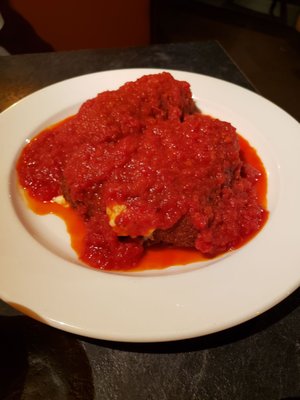
Locate an element on the screen. The width and height of the screenshot is (300, 400). floor is located at coordinates (270, 54).